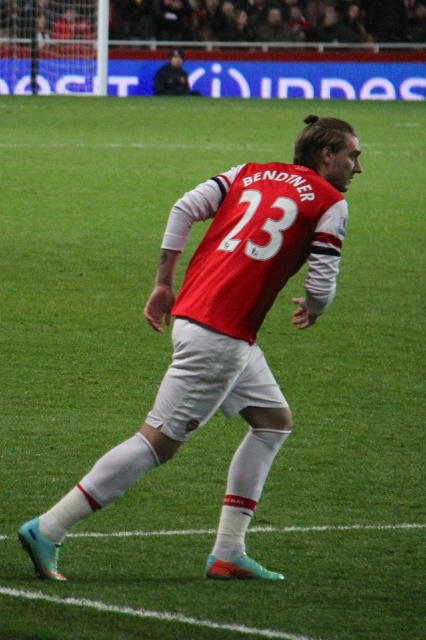
You are a photographer at the soccer match. You want to capture a photo of the red matte jersey at center and the matte red jersey at upper center. Which jersey should you focus on first to ensure both are in frame?

The red matte jersey at center is below the matte red jersey at upper center, so you should focus on the matte red jersey at upper center first to ensure both are in frame.

You are a soccer fan trying to take a photo of the player wearing the red matte jersey at center and the matte red jersey at upper center. Which jersey should you zoom in on to capture the details of the number 23 on the back?

The red matte jersey at center has a greater width than the matte red jersey at upper center, so you should zoom in on the red matte jersey at center to capture the details of the number 23 on the back.